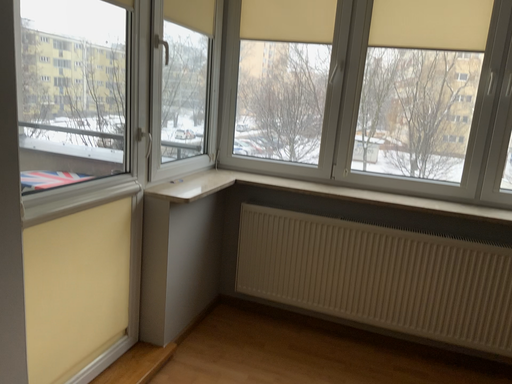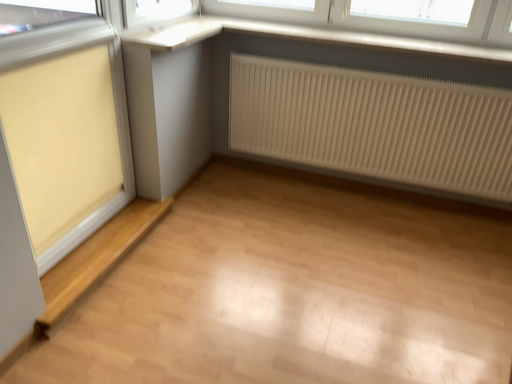
Question: Which way did the camera rotate in the video?

Choices:
 (A) rotated downward
 (B) rotated upward

Answer: (A)